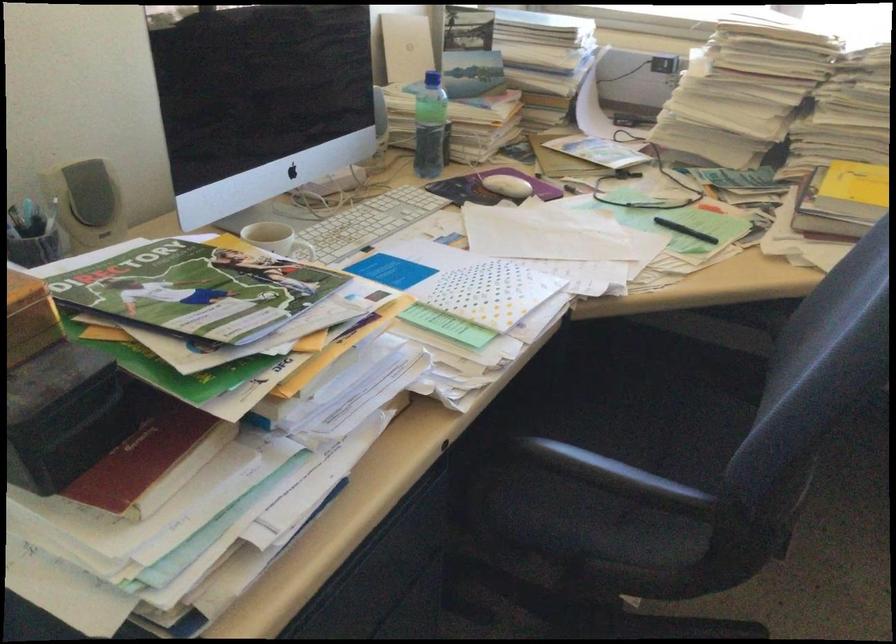
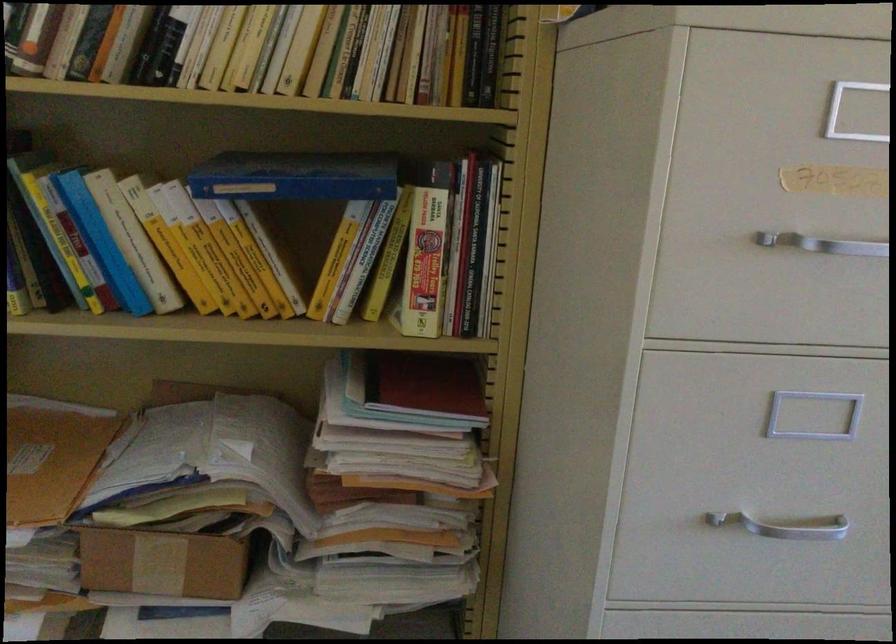
Question: The camera is either moving clockwise (left) or counter-clockwise (right) around the object. The first image is from the beginning of the video and the second image is from the end. Is the camera moving left or right when shooting the video?

Choices:
 (A) Left
 (B) Right

Answer: (B)